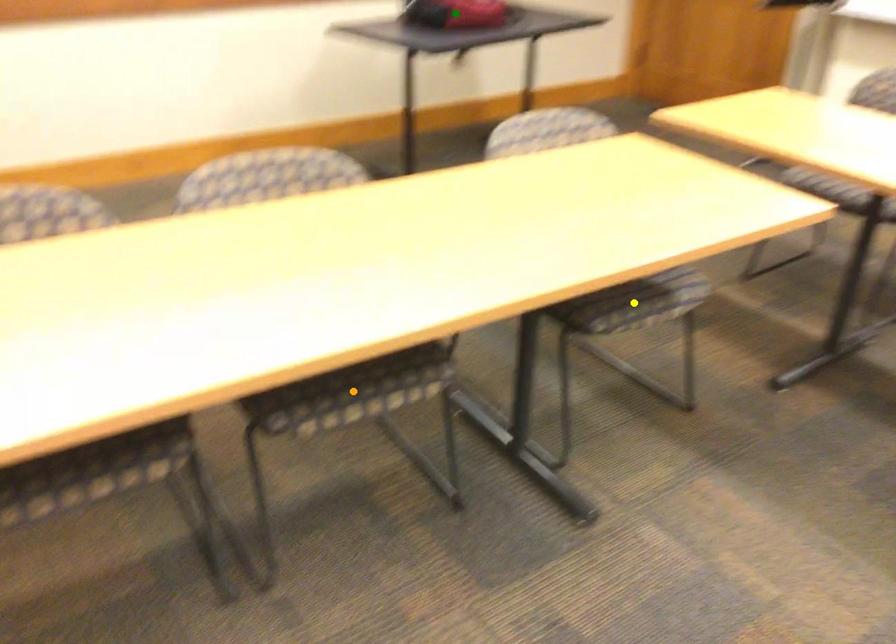
Order these from farthest to nearest:
orange point, yellow point, green point

green point < yellow point < orange point